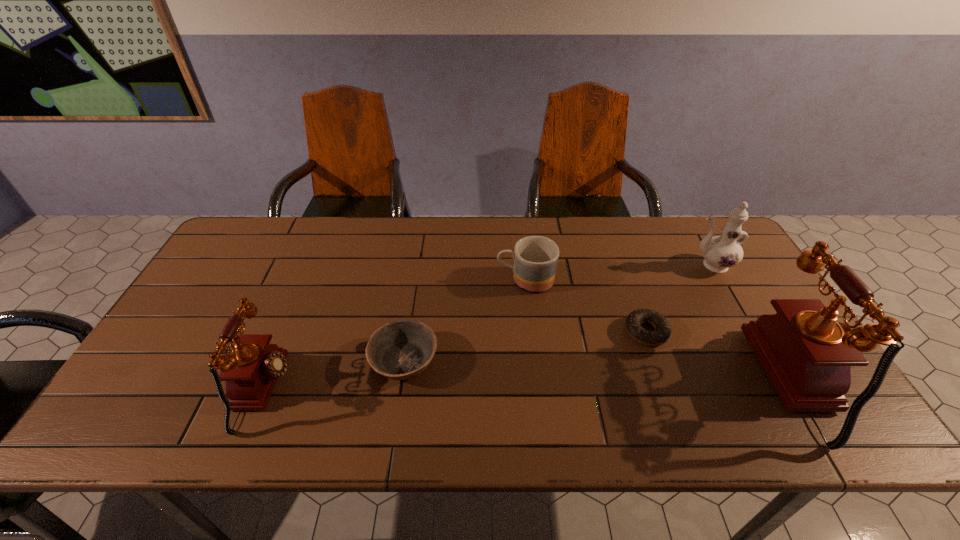
Please point a space for a new telephone to maintain equal intervals. Please provide its 2D coordinates. Your answer should be formatted as a tuple, i.e. [(x, y)], where the tuple contains the x and y coordinates of a point satisfying the conditions above.

[(537, 386)]